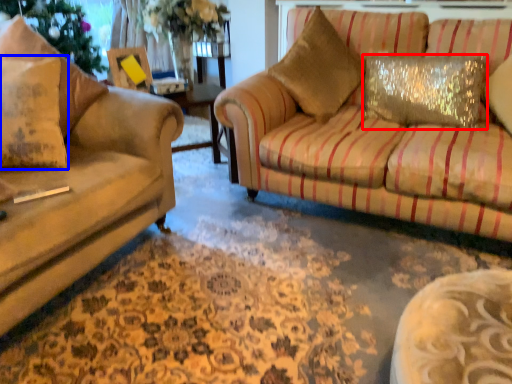
Question: Which point is further to the camera, pillow (highlighted by a red box) or pillow (highlighted by a blue box)?

Choices:
 (A) pillow
 (B) pillow

Answer: (A)